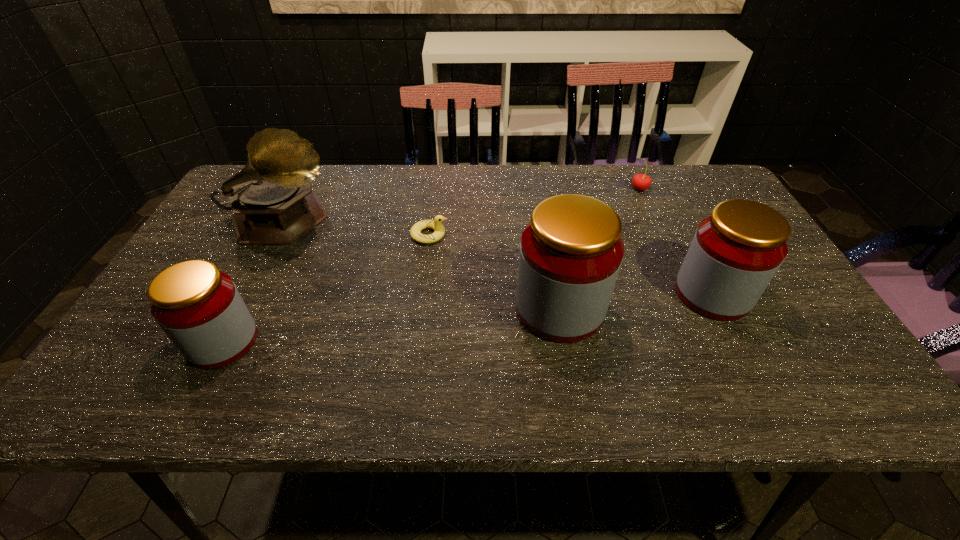
Find the location of a particular element. This screenshot has height=540, width=960. the fourth tallest object is located at coordinates (199, 308).

The width and height of the screenshot is (960, 540). Identify the location of the shortest jar. (199, 308).

Locate an element on the screen. the third object from right to left is located at coordinates (571, 251).

Identify the location of the third tallest object. (736, 251).

This screenshot has height=540, width=960. What are the coordinates of `the second tallest jar` in the screenshot? It's located at (736, 251).

The width and height of the screenshot is (960, 540). Find the location of `phonograph record`. phonograph record is located at coordinates (272, 201).

Where is `the third object from left to right`? The width and height of the screenshot is (960, 540). the third object from left to right is located at coordinates (436, 224).

You are a GUI agent. You are given a task and a screenshot of the screen. Output one action in this format:
    pyautogui.click(x=<x>, y=<y>)
    Task: Click on the duckling
    This screenshot has height=540, width=960.
    Given the screenshot: What is the action you would take?
    pyautogui.click(x=436, y=224)

The image size is (960, 540). What are the coordinates of `cherry` in the screenshot? It's located at (641, 182).

You are a GUI agent. You are given a task and a screenshot of the screen. Output one action in this format:
    pyautogui.click(x=<x>, y=<y>)
    Task: Click on the vacant space situated on the right of the fourth tallest object
    The width and height of the screenshot is (960, 540).
    Given the screenshot: What is the action you would take?
    pyautogui.click(x=279, y=341)